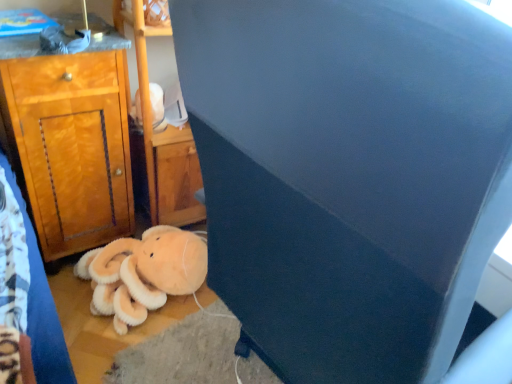
Where is `soft orange plush at lower left`? The height and width of the screenshot is (384, 512). soft orange plush at lower left is located at coordinates tap(143, 273).

Measure the distance between white plush toy at upper center and camera.

white plush toy at upper center and camera are 4.92 feet apart.

The width and height of the screenshot is (512, 384). What do you see at coordinates (157, 107) in the screenshot?
I see `white plush toy at upper center` at bounding box center [157, 107].

Describe the element at coordinates (349, 174) in the screenshot. The image size is (512, 384). I see `dark blue fabric at center` at that location.

This screenshot has height=384, width=512. I want to click on dark blue fabric at center, so click(x=349, y=174).

Find the location of a particular element. Image resolution: width=512 pixels, height=384 pixels. wooden cabinet at left is located at coordinates (70, 140).

Which is more to the right, white plush toy at upper center or dark blue fabric at center?

dark blue fabric at center is more to the right.

Can you confirm if white plush toy at upper center is shorter than dark blue fabric at center?

Yes.

Is dark blue fabric at center a part of white plush toy at upper center?

No, dark blue fabric at center is not surrounded by white plush toy at upper center.

Is dark blue fabric at center in contact with soft orange plush at lower left?

There is a gap between dark blue fabric at center and soft orange plush at lower left.

Considering the relative sizes of dark blue fabric at center and soft orange plush at lower left in the image provided, is dark blue fabric at center thinner than soft orange plush at lower left?

No, dark blue fabric at center is not thinner than soft orange plush at lower left.

Can you confirm if dark blue fabric at center is taller than soft orange plush at lower left?

Yes, dark blue fabric at center is taller than soft orange plush at lower left.

Considering the positions of objects dark blue fabric at center and soft orange plush at lower left in the image provided, who is in front, dark blue fabric at center or soft orange plush at lower left?

Positioned in front is dark blue fabric at center.

Which of these two, white plush toy at upper center or soft orange plush at lower left, is thinner?

white plush toy at upper center is thinner.

From the image's perspective, is white plush toy at upper center on top of soft orange plush at lower left?

Yes, from the image's perspective, white plush toy at upper center is above soft orange plush at lower left.

Could soft orange plush at lower left be considered to be inside white plush toy at upper center?

Actually, soft orange plush at lower left is outside white plush toy at upper center.

Is white plush toy at upper center closer to camera compared to soft orange plush at lower left?

No.

Which point is more forward, (78, 60) or (130, 310)?

The point (78, 60) is closer.

Where is `cabinetry above the soft orange plush at lower left (from the image's perspective)`? This screenshot has width=512, height=384. cabinetry above the soft orange plush at lower left (from the image's perspective) is located at coordinates (70, 140).

Is wooden cabinet at left looking in the opposite direction of soft orange plush at lower left?

No, wooden cabinet at left's orientation is not away from soft orange plush at lower left.

Visually, is wooden cabinet at left positioned to the left or to the right of soft orange plush at lower left?

Based on their positions, wooden cabinet at left is located to the left of soft orange plush at lower left.

Considering the sizes of soft orange plush at lower left and white plush toy at upper center in the image, is soft orange plush at lower left taller or shorter than white plush toy at upper center?

Considering their sizes, soft orange plush at lower left has more height than white plush toy at upper center.

Is soft orange plush at lower left spatially inside white plush toy at upper center, or outside of it?

soft orange plush at lower left cannot be found inside white plush toy at upper center.

Is soft orange plush at lower left far from white plush toy at upper center?

Actually, soft orange plush at lower left and white plush toy at upper center are a little close together.

From a real-world perspective, is soft orange plush at lower left physically above white plush toy at upper center?

No, from a real-world perspective, soft orange plush at lower left is not on top of white plush toy at upper center.

Would you say dark blue fabric at center is part of soft orange plush at lower left's contents?

No, dark blue fabric at center is not inside soft orange plush at lower left.

Would you consider soft orange plush at lower left to be distant from dark blue fabric at center?

They are positioned close to each other.

Is soft orange plush at lower left oriented towards dark blue fabric at center?

No, soft orange plush at lower left does not turn towards dark blue fabric at center.

From a real-world perspective, which is physically above, soft orange plush at lower left or dark blue fabric at center?

dark blue fabric at center.

Considering the relative sizes of dark blue fabric at center and white plush toy at upper center in the image provided, is dark blue fabric at center taller than white plush toy at upper center?

Yes, dark blue fabric at center is taller than white plush toy at upper center.

Which object is closer to the camera, dark blue fabric at center or white plush toy at upper center?

Positioned in front is dark blue fabric at center.

In the image, is dark blue fabric at center on the left side or the right side of white plush toy at upper center?

In the image, dark blue fabric at center appears on the right side of white plush toy at upper center.

Image resolution: width=512 pixels, height=384 pixels. What are the coordinates of `furniture that appears below the white plush toy at upper center (from the image's perspective)` in the screenshot? It's located at (349, 174).

What are the coordinates of `furniture above the soft orange plush at lower left (from the image's perspective)` in the screenshot? It's located at (349, 174).

When comparing their distances from white plush toy at upper center, does dark blue fabric at center or soft orange plush at lower left seem closer?

Among the two, soft orange plush at lower left is located nearer to white plush toy at upper center.

When comparing their distances from dark blue fabric at center, does soft orange plush at lower left or wooden cabinet at left seem further?

The object further to dark blue fabric at center is wooden cabinet at left.

Estimate the real-world distances between objects in this image. Which object is further from white plush toy at upper center, wooden cabinet at left or dark blue fabric at center?

Among the two, dark blue fabric at center is located further to white plush toy at upper center.

Estimate the real-world distances between objects in this image. Which object is closer to dark blue fabric at center, white plush toy at upper center or wooden cabinet at left?

Based on the image, wooden cabinet at left appears to be nearer to dark blue fabric at center.

From the image, which object appears to be farther from white plush toy at upper center, wooden cabinet at left or soft orange plush at lower left?

The object further to white plush toy at upper center is soft orange plush at lower left.

Estimate the real-world distances between objects in this image. Which object is further from wooden cabinet at left, soft orange plush at lower left or dark blue fabric at center?

dark blue fabric at center lies further to wooden cabinet at left than the other object.

Estimate the real-world distances between objects in this image. Which object is further from soft orange plush at lower left, dark blue fabric at center or wooden cabinet at left?

dark blue fabric at center.

Looking at the image, which one is located closer to white plush toy at upper center, soft orange plush at lower left or dark blue fabric at center?

soft orange plush at lower left lies closer to white plush toy at upper center than the other object.

This screenshot has width=512, height=384. In order to click on cabinetry between white plush toy at upper center and soft orange plush at lower left vertically in this screenshot , I will do `click(70, 140)`.

Identify the location of cabinetry between dark blue fabric at center and soft orange plush at lower left from front to back. This screenshot has width=512, height=384. [x=70, y=140].

What are the coordinates of `cabinetry between dark blue fabric at center and white plush toy at upper center along the z-axis` in the screenshot? It's located at (70, 140).

Identify the location of teddy bear between dark blue fabric at center and white plush toy at upper center in the front-back direction. The height and width of the screenshot is (384, 512). (143, 273).